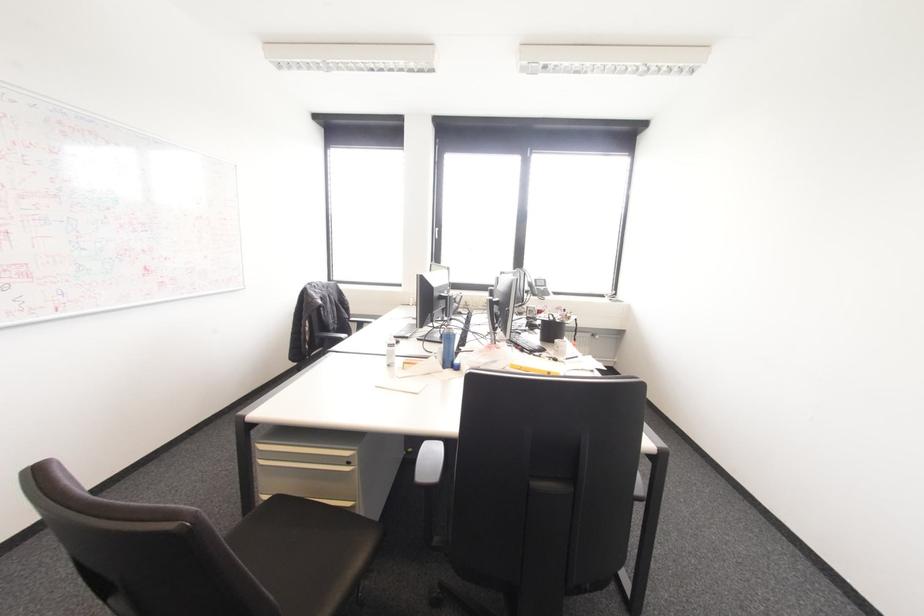
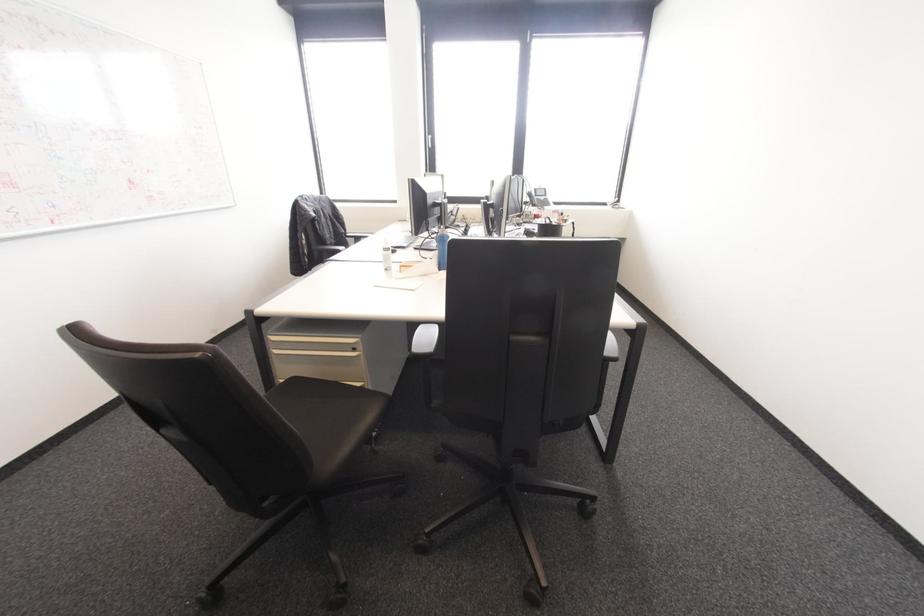
Locate, in the second image, the point that corresponds to point 347,463 in the first image.

(354, 349)